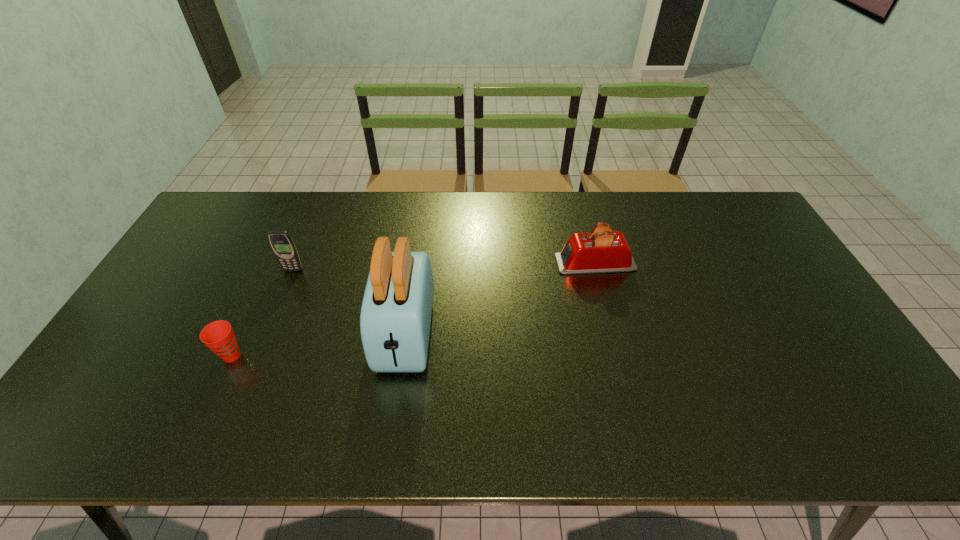
Locate an element on the screen. This screenshot has width=960, height=540. free space at the far edge is located at coordinates coord(526,201).

Locate an element on the screen. This screenshot has height=540, width=960. free region at the near edge of the desktop is located at coordinates pos(208,430).

At what (x,y) coordinates should I click in order to perform the action: click on vacant space at the right edge of the desktop. Please return your answer as a coordinate pair (x, y). Looking at the image, I should click on (827, 323).

Where is `free point at the near left corner`? free point at the near left corner is located at coordinates (110, 446).

Locate an element on the screen. Image resolution: width=960 pixels, height=540 pixels. free space at the far right corner is located at coordinates (732, 200).

The width and height of the screenshot is (960, 540). In order to click on unoccupied position between the cup and the cellular telephone in this screenshot , I will do (262, 313).

Find the location of a particular element. vacant area between the cellular telephone and the tallest object is located at coordinates (349, 302).

Identify the location of vacant area that lies between the tallest object and the right toaster. (500, 299).

This screenshot has width=960, height=540. I want to click on vacant space in between the cellular telephone and the shortest object, so click(262, 313).

Locate an element on the screen. The width and height of the screenshot is (960, 540). free space between the cellular telephone and the shortest object is located at coordinates (262, 313).